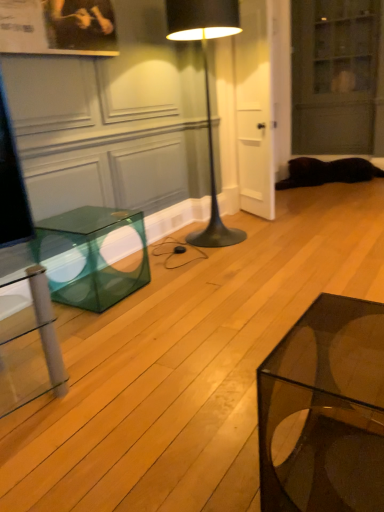
Question: Considering the relative positions of transparent glass coffee table at lower right and transparent glass cabinet at upper right in the image provided, is transparent glass coffee table at lower right to the left or to the right of transparent glass cabinet at upper right?

Choices:
 (A) right
 (B) left

Answer: (B)

Question: Considering the positions of transparent glass coffee table at lower right and transparent glass cabinet at upper right in the image, is transparent glass coffee table at lower right wider or thinner than transparent glass cabinet at upper right?

Choices:
 (A) thin
 (B) wide

Answer: (B)

Question: Estimate the real-world distances between objects in this image. Which object is farther from the transparent glass cube at left?

Choices:
 (A) black metal floor lamp at center
 (B) transparent glass coffee table at lower right
 (C) black fur cat at lower right
 (D) transparent glass cabinet at upper right

Answer: (D)

Question: Which object is positioned closest to the black fur cat at lower right?

Choices:
 (A) transparent glass coffee table at lower right
 (B) black metal floor lamp at center
 (C) transparent glass cabinet at upper right
 (D) transparent glass cube at left

Answer: (C)